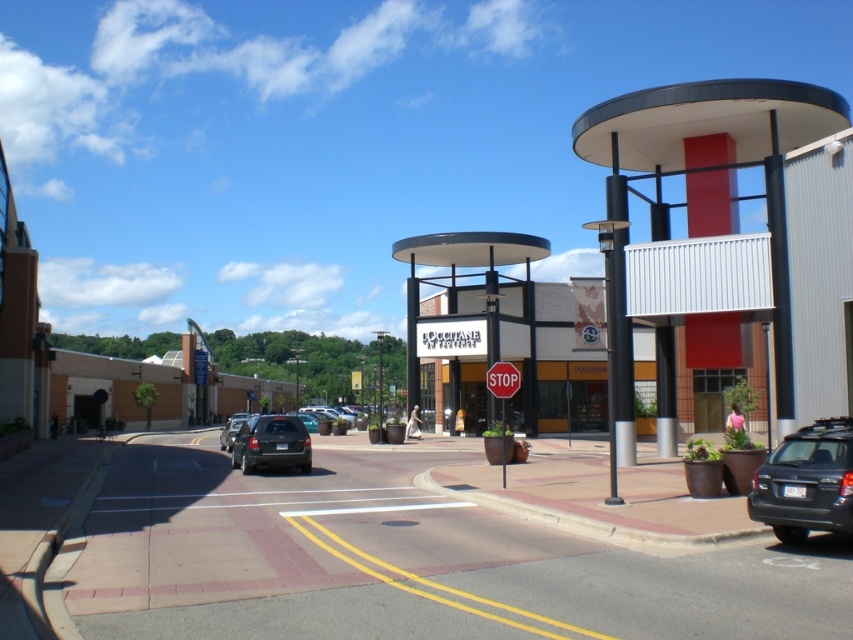
Question: Estimate the real-world distances between objects in this image. Which object is closer to the black metallic pole at center-right?

Choices:
 (A) matte black suv at center-left
 (B) red matte stop sign at center

Answer: (B)

Question: Is matte black suv at lower right positioned before black metallic pole at center-right?

Choices:
 (A) no
 (B) yes

Answer: (B)

Question: Which of the following is the farthest from the observer?

Choices:
 (A) (621, 240)
 (B) (293, 422)
 (C) (509, 392)
 (D) (781, 481)

Answer: (B)

Question: Observing the image, what is the correct spatial positioning of white matte signboard at center in reference to matte black suv at lower right?

Choices:
 (A) below
 (B) above

Answer: (B)

Question: Which point is farther to the camera?

Choices:
 (A) (759, 502)
 (B) (437, 298)
 (C) (494, 372)

Answer: (B)

Question: Where is black metallic pole at center-right located in relation to red matte stop sign at center in the image?

Choices:
 (A) above
 (B) below

Answer: (A)